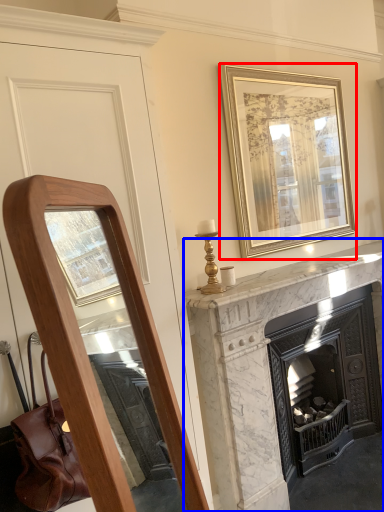
Question: Which point is closer to the camera, picture frame (highlighted by a red box) or fireplace (highlighted by a blue box)?

Choices:
 (A) picture frame
 (B) fireplace

Answer: (B)